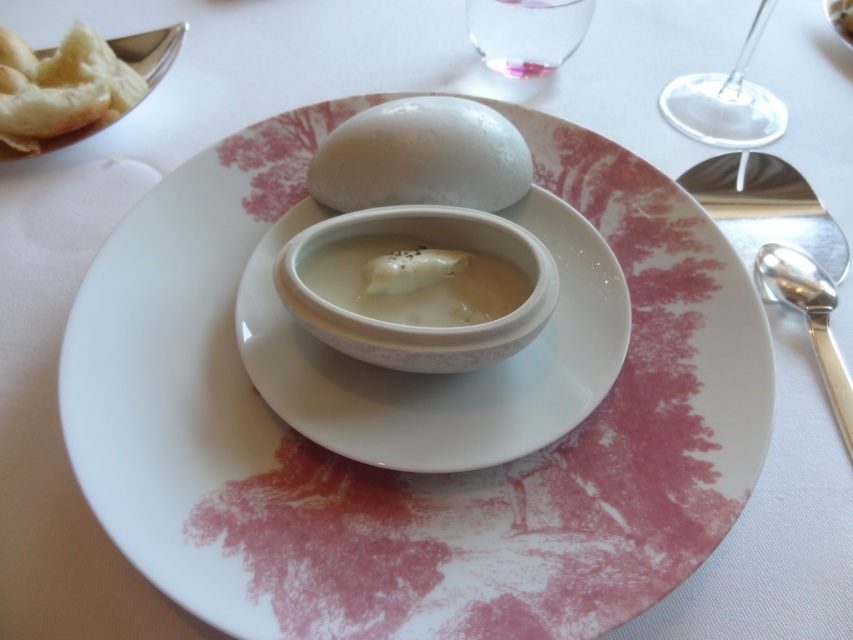
Question: Where is white creamy gravy at center located in relation to silver metallic spoon at lower right in the image?

Choices:
 (A) above
 (B) below

Answer: (A)

Question: Which object appears farthest from the camera in this image?

Choices:
 (A) white glossy plate at center
 (B) silver metallic spoon at right
 (C) white creamy gravy at center

Answer: (B)

Question: Is white matte egg at center further to the viewer compared to transparent glass at upper right?

Choices:
 (A) no
 (B) yes

Answer: (A)

Question: Which object is closer to the camera taking this photo?

Choices:
 (A) white matte egg at upper center
 (B) transparent glass at upper right
 (C) silver metallic spoon at lower right
 (D) golden brown bread at upper left

Answer: (C)

Question: Does white ceramic saucer at center have a greater width compared to golden brown bread at upper left?

Choices:
 (A) yes
 (B) no

Answer: (A)

Question: Which point is closer to the camera?

Choices:
 (A) (233, 580)
 (B) (817, 362)
 (C) (323, 211)
 (D) (445, 304)

Answer: (A)